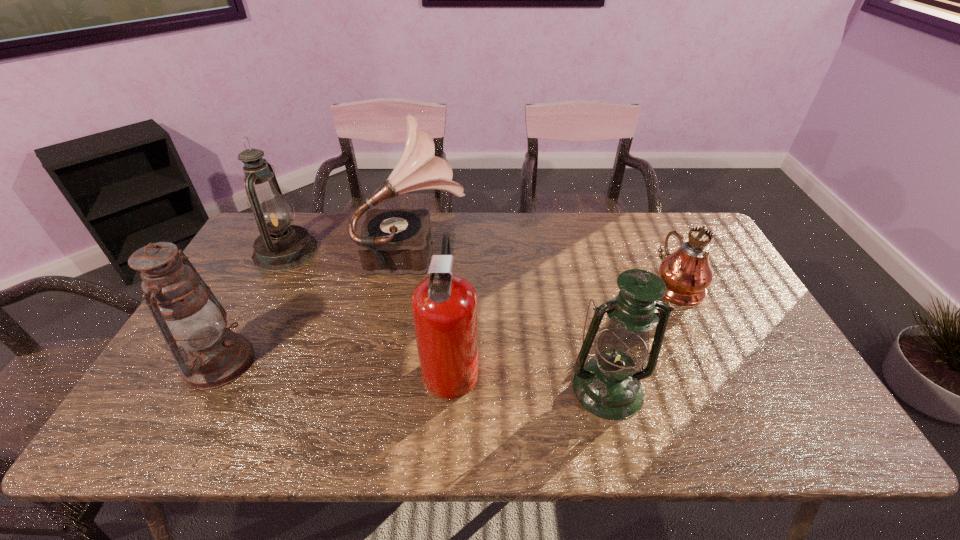
The width and height of the screenshot is (960, 540). In order to click on record player in this screenshot , I will do `click(397, 241)`.

This screenshot has width=960, height=540. What are the coordinates of `fire extinguisher` in the screenshot? It's located at (445, 306).

The width and height of the screenshot is (960, 540). I want to click on the rightmost object, so click(x=687, y=273).

Image resolution: width=960 pixels, height=540 pixels. What are the coordinates of `the third oil lamp from left to right` in the screenshot? It's located at (608, 385).

The image size is (960, 540). Identify the location of vacant point located from the horn of the record player. [x=486, y=251].

Locate an element on the screen. vacant region located with the handle and nozzle on the fire extinguisher is located at coordinates (627, 364).

You are a GUI agent. You are given a task and a screenshot of the screen. Output one action in this format:
    pyautogui.click(x=<x>, y=<y>)
    Task: Click on the blank area located 0.310m on the left of the rightmost object
    Image resolution: width=960 pixels, height=540 pixels.
    Given the screenshot: What is the action you would take?
    pyautogui.click(x=549, y=284)

Image resolution: width=960 pixels, height=540 pixels. I want to click on blank area located on the left of the second object from right to left, so click(x=447, y=389).

You are a GUI agent. You are given a task and a screenshot of the screen. Output one action in this format:
    pyautogui.click(x=<x>, y=<y>)
    Task: Click on the record player that is positioned at the far edge
    
    Given the screenshot: What is the action you would take?
    pyautogui.click(x=397, y=241)

Where is `oil lamp that is at the far edge`? This screenshot has height=540, width=960. oil lamp that is at the far edge is located at coordinates (280, 246).